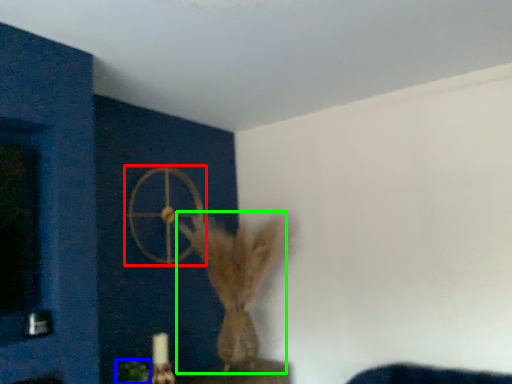
Question: Based on their relative distances, which object is farther from wheel (highlighted by a red box)? Choose from plant (highlighted by a blue box) and animal (highlighted by a green box).

Choices:
 (A) plant
 (B) animal

Answer: (A)